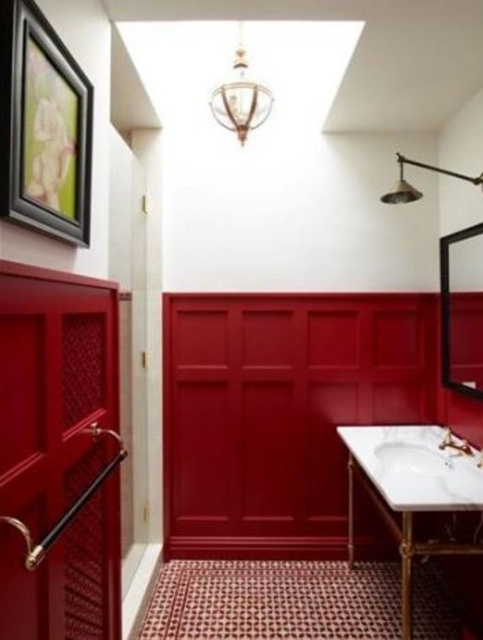
Can you confirm if white marble vanity at center is thinner than gold metallic chandelier at upper center?

Incorrect, white marble vanity at center's width is not less than gold metallic chandelier at upper center's.

Is white marble vanity at center wider than gold metallic chandelier at upper center?

Yes, white marble vanity at center is wider than gold metallic chandelier at upper center.

Is point (466, 547) more distant than point (253, 93)?

No, (466, 547) is in front of (253, 93).

Find the location of `white marble vanity at center`. white marble vanity at center is located at coordinates (411, 490).

Which is behind, point (446, 454) or point (383, 195)?

Positioned behind is point (383, 195).

This screenshot has height=640, width=483. What are the coordinates of `white marble vanity at center` in the screenshot? It's located at (411, 490).

The width and height of the screenshot is (483, 640). What are the coordinates of `gold metallic chandelier at upper center` in the screenshot? It's located at (241, 97).

What do you see at coordinates (241, 97) in the screenshot? The width and height of the screenshot is (483, 640). I see `gold metallic chandelier at upper center` at bounding box center [241, 97].

Locate an element on the screen. The height and width of the screenshot is (640, 483). gold metallic chandelier at upper center is located at coordinates (241, 97).